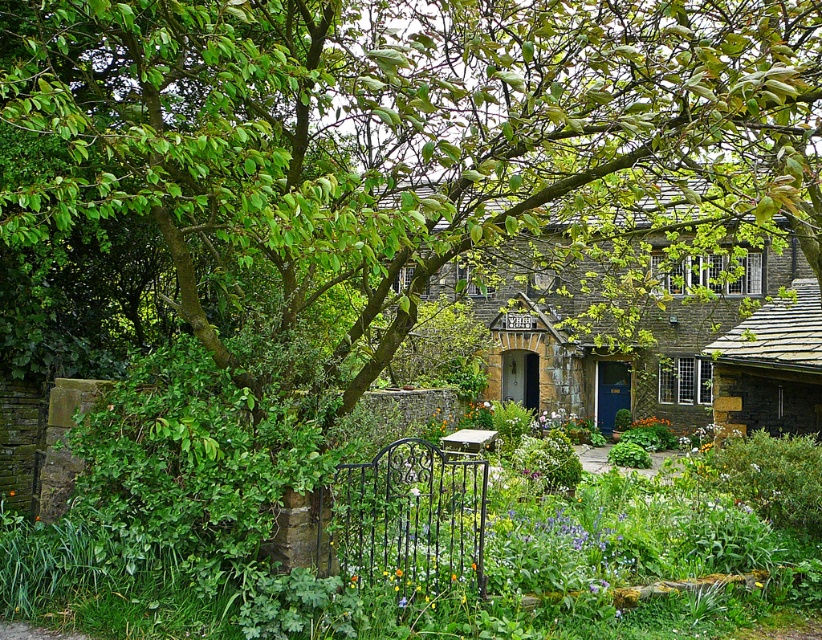
Is point (621, 488) less distant than point (550, 280)?

Yes.

Between point (373, 604) and point (691, 416), which one is positioned behind?

The point (691, 416) is behind.

At what (x,y) coordinates should I click in order to perform the action: click on green leafy bush at lower left. Please return your answer as a coordinate pair (x, y). Image resolution: width=822 pixels, height=640 pixels. Looking at the image, I should click on (483, 560).

Locate an element on the screen. green leafy bush at lower left is located at coordinates (483, 560).